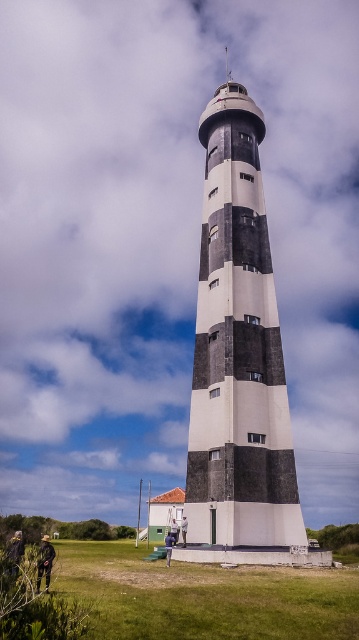
Is black and white striped lighthouse at center wider than green grass at lower center?

No, black and white striped lighthouse at center is not wider than green grass at lower center.

Which is more to the right, black and white striped lighthouse at center or green grass at lower center?

From the viewer's perspective, black and white striped lighthouse at center appears more on the right side.

Is point (197, 424) positioned in front of point (117, 572)?

No.

This screenshot has height=640, width=359. Identify the location of black and white striped lighthouse at center. (239, 355).